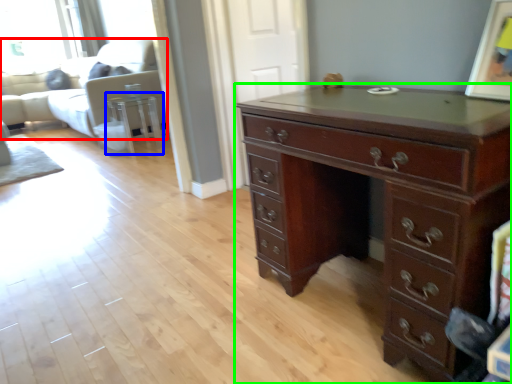
Question: Which is farther away from couch (highlighted by a red box)? side table (highlighted by a blue box) or chest of drawers (highlighted by a green box)?

Choices:
 (A) side table
 (B) chest of drawers

Answer: (B)